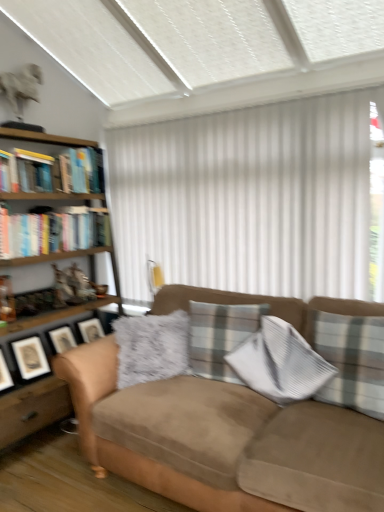
The width and height of the screenshot is (384, 512). I want to click on free spot above hardcover book at left, which appears as the 2th book when viewed from the top (from a real-world perspective), so click(38, 160).